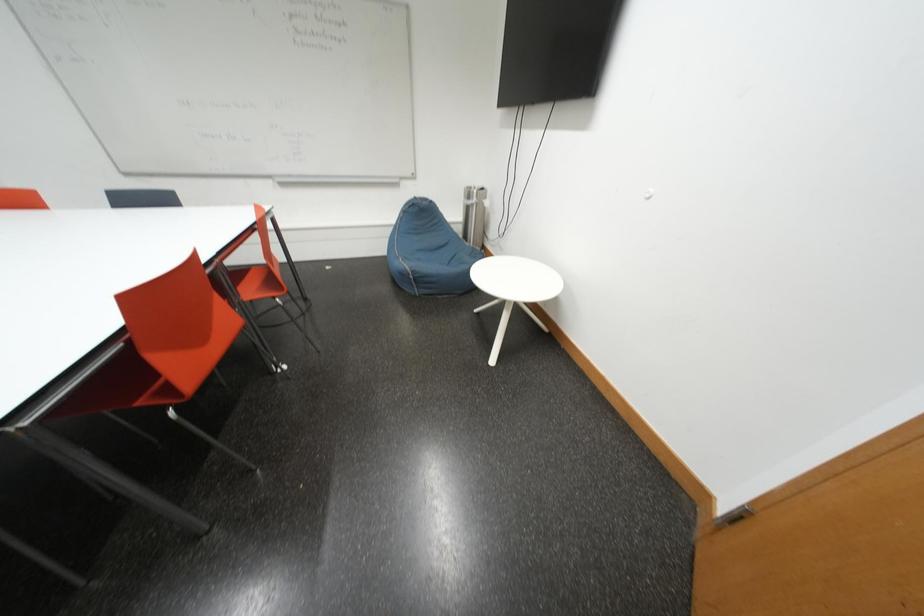
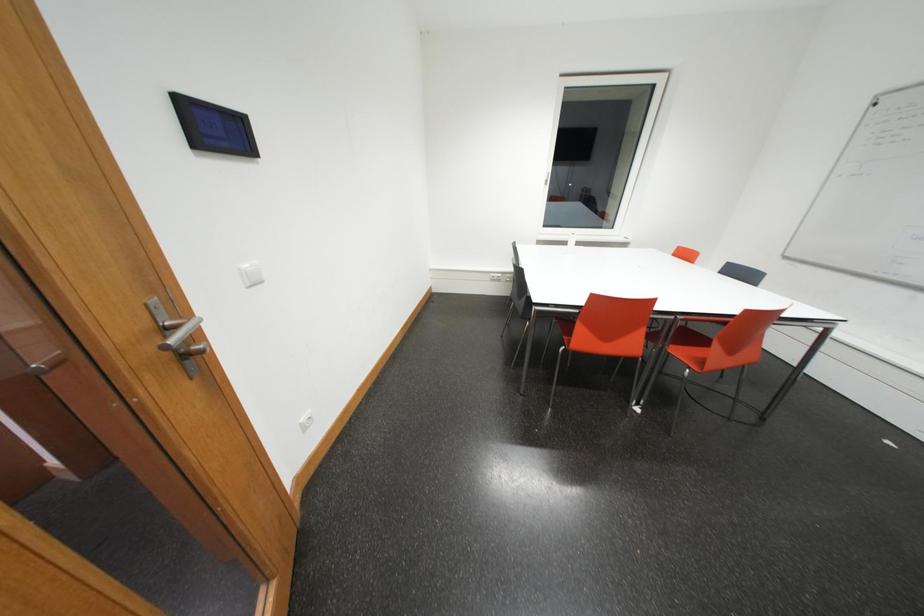
Based on the continuous images, in which direction is the camera rotating?

The rotation direction of the camera is left-down.